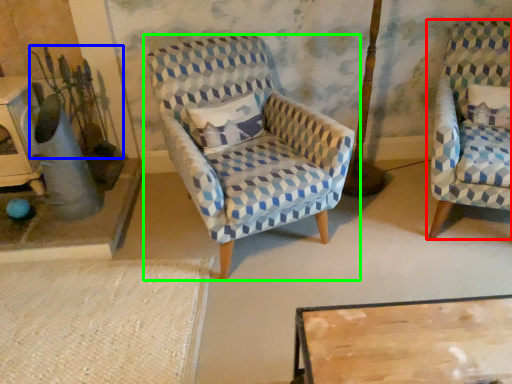
Question: Based on their relative distances, which object is nearer to chair (highlighted by a red box)? Choose from plant (highlighted by a blue box) and chair (highlighted by a green box).

Choices:
 (A) plant
 (B) chair

Answer: (B)